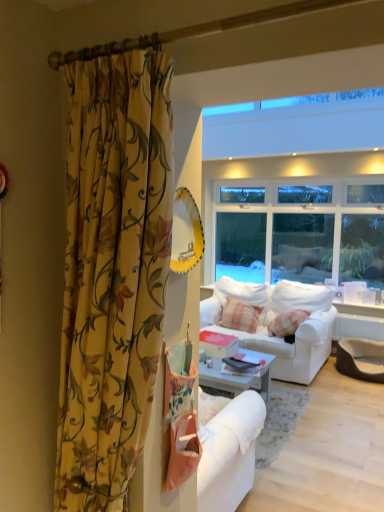
Measure the distance between point (331, 330) and camera.

Point (331, 330) and camera are 4.43 meters apart from each other.

Where is `white fabric couch at center`? The width and height of the screenshot is (384, 512). white fabric couch at center is located at coordinates (294, 346).

The height and width of the screenshot is (512, 384). I want to click on striped cotton pillow at center, so click(x=240, y=316).

Considering the relative sizes of floral fabric curtain at left and striped cotton pillow at center in the image provided, is floral fabric curtain at left shorter than striped cotton pillow at center?

Incorrect, the height of floral fabric curtain at left does not fall short of that of striped cotton pillow at center.

Is floral fabric curtain at left oriented away from striped cotton pillow at center?

No, floral fabric curtain at left is not facing away from striped cotton pillow at center.

Is point (110, 304) positioned in front of point (239, 306)?

Yes.

From a real-world perspective, who is located higher, floral fabric curtain at left or striped cotton pillow at center?

From a 3D spatial view, floral fabric curtain at left is above.

From the image's perspective, is white fabric couch at center located above floral fabric curtain at left?

No.

Is point (311, 341) positioned after point (118, 332)?

Yes.

Is white fabric couch at center turned away from floral fabric curtain at left?

white fabric couch at center is not turned away from floral fabric curtain at left.

Between floral fabric curtain at left and white fabric couch at center, which one has larger size?

white fabric couch at center.

Is floral fabric curtain at left touching white fabric couch at center?

No, floral fabric curtain at left is not with white fabric couch at center.

Which is correct: floral fabric curtain at left is inside white fabric couch at center, or outside of it?

floral fabric curtain at left is outside white fabric couch at center.

From the image's perspective, is floral fabric curtain at left located above or below white fabric couch at center?

floral fabric curtain at left is above white fabric couch at center.

Based on the photo, could floral fabric curtain at left be considered to be inside striped cotton pillow at center?

Definitely not — floral fabric curtain at left is not inside striped cotton pillow at center.

From the image's perspective, which is above, striped cotton pillow at center or floral fabric curtain at left?

From the image's view, floral fabric curtain at left is above.

Does striped cotton pillow at center turn towards floral fabric curtain at left?

Yes, striped cotton pillow at center is turned towards floral fabric curtain at left.

Is striped cotton pillow at center in front of or behind floral fabric curtain at left in the image?

striped cotton pillow at center is positioned farther from the viewer than floral fabric curtain at left.

Which object is further away from the camera taking this photo, striped cotton pillow at center or white fabric couch at center?

striped cotton pillow at center is more distant.

Where is `pillow behind the white fabric couch at center`? The height and width of the screenshot is (512, 384). pillow behind the white fabric couch at center is located at coordinates (240, 316).

From the picture: Could white fabric couch at center be considered to be inside striped cotton pillow at center?

That's incorrect, white fabric couch at center is not inside striped cotton pillow at center.

What's the angular difference between white fabric couch at center and striped cotton pillow at center's facing directions?

1.71 degrees separate the facing orientations of white fabric couch at center and striped cotton pillow at center.

Is white fabric couch at center bigger than striped cotton pillow at center?

Indeed, white fabric couch at center has a larger size compared to striped cotton pillow at center.

Which is in front, white fabric couch at center or striped cotton pillow at center?

white fabric couch at center.

How far apart are white fabric couch at center and striped cotton pillow at center?

white fabric couch at center and striped cotton pillow at center are 18.70 inches apart from each other.

At what (x,y) coordinates should I click in order to perform the action: click on curtain located on the left of striped cotton pillow at center. Please return your answer as a coordinate pair (x, y). This screenshot has width=384, height=512. Looking at the image, I should click on (112, 266).

The image size is (384, 512). What are the coordinates of `studio couch below the floral fabric curtain at left (from the image's perspective)` in the screenshot? It's located at (294, 346).

Considering their positions, is floral fabric curtain at left positioned further to white fabric couch at center than striped cotton pillow at center?

floral fabric curtain at left is further to white fabric couch at center.

Estimate the real-world distances between objects in this image. Which object is closer to floral fabric curtain at left, striped cotton pillow at center or white fabric couch at center?

white fabric couch at center.

Based on their spatial positions, is white fabric couch at center or striped cotton pillow at center further from floral fabric curtain at left?

Among the two, striped cotton pillow at center is located further to floral fabric curtain at left.

From the image, which object appears to be farther from white fabric couch at center, striped cotton pillow at center or floral fabric curtain at left?

floral fabric curtain at left lies further to white fabric couch at center than the other object.

Looking at this image, based on their spatial positions, is floral fabric curtain at left or white fabric couch at center closer to striped cotton pillow at center?

white fabric couch at center is positioned closer to the anchor striped cotton pillow at center.

Based on their spatial positions, is white fabric couch at center or floral fabric curtain at left closer to striped cotton pillow at center?

Among the two, white fabric couch at center is located nearer to striped cotton pillow at center.

The width and height of the screenshot is (384, 512). What are the coordinates of `studio couch located between floral fabric curtain at left and striped cotton pillow at center in the depth direction` in the screenshot? It's located at (294, 346).